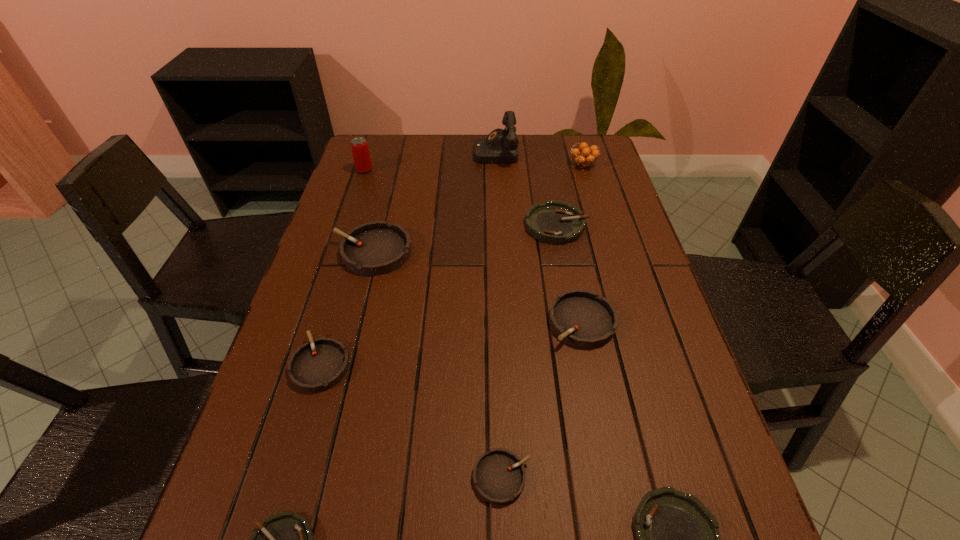
The image size is (960, 540). What are the coordinates of `gray telephone` in the screenshot? It's located at (501, 146).

I want to click on telephone, so click(x=501, y=146).

Identify the location of pink beer can. (x=359, y=146).

The image size is (960, 540). In order to click on beer can in this screenshot , I will do `click(359, 146)`.

At what (x,y) coordinates should I click in order to perform the action: click on orange orange fruit. Please return your answer as a coordinate pair (x, y). Looking at the image, I should click on (583, 158).

Locate an element on the screen. the eighth shortest object is located at coordinates (583, 158).

At what (x,y) coordinates should I click in order to perform the action: click on the biggest gray ashtray. Please return your answer as a coordinate pair (x, y). Looking at the image, I should click on (375, 248).

Locate an element on the screen. This screenshot has width=960, height=540. the farthest gray ashtray is located at coordinates (375, 248).

Locate an element on the screen. The height and width of the screenshot is (540, 960). the fifth tallest object is located at coordinates (581, 318).

The height and width of the screenshot is (540, 960). Identify the location of the sixth shortest ashtray. (581, 318).